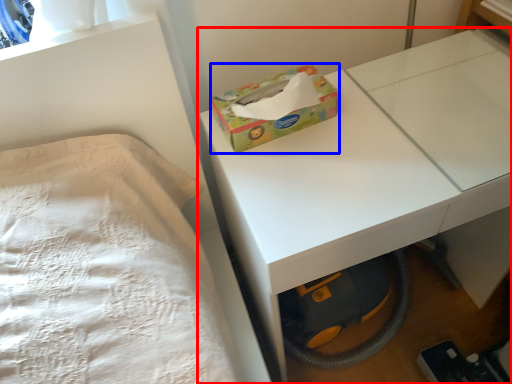
Question: Which object is further to the camera taking this photo, table (highlighted by a red box) or box (highlighted by a blue box)?

Choices:
 (A) table
 (B) box

Answer: (B)